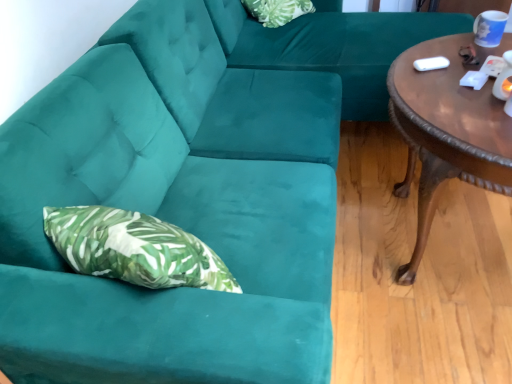
Question: From a real-world perspective, is velvet green couch at center on brown polished wood coffee table at right?

Choices:
 (A) no
 (B) yes

Answer: (B)

Question: Is velvet green couch at center turned away from brown polished wood coffee table at right?

Choices:
 (A) yes
 (B) no

Answer: (B)

Question: From the image's perspective, is velvet green couch at center above brown polished wood coffee table at right?

Choices:
 (A) no
 (B) yes

Answer: (B)

Question: Does velvet green couch at center come in front of brown polished wood coffee table at right?

Choices:
 (A) yes
 (B) no

Answer: (B)

Question: Is velvet green couch at center bigger than brown polished wood coffee table at right?

Choices:
 (A) no
 (B) yes

Answer: (B)

Question: Is point (414, 14) positioned closer to the camera than point (262, 11)?

Choices:
 (A) closer
 (B) farther

Answer: (A)

Question: Considering their positions, is velvet green couch at center located in front of or behind green leafy fabric pillow at upper center?

Choices:
 (A) behind
 (B) front

Answer: (B)

Question: Looking at their shapes, would you say velvet green couch at center is wider or thinner than green leafy fabric pillow at upper center?

Choices:
 (A) thin
 (B) wide

Answer: (B)

Question: Is velvet green couch at center taller or shorter than green leafy fabric pillow at upper center?

Choices:
 (A) short
 (B) tall

Answer: (B)

Question: Looking at their shapes, would you say brown polished wood coffee table at right is wider or thinner than green leafy fabric pillow at upper center?

Choices:
 (A) wide
 (B) thin

Answer: (A)

Question: Is point (477, 158) closer or farther from the camera than point (292, 13)?

Choices:
 (A) farther
 (B) closer

Answer: (B)

Question: Considering their positions, is brown polished wood coffee table at right located in front of or behind green leafy fabric pillow at upper center?

Choices:
 (A) behind
 (B) front

Answer: (B)

Question: In terms of height, does brown polished wood coffee table at right look taller or shorter compared to green leafy fabric pillow at upper center?

Choices:
 (A) short
 (B) tall

Answer: (B)

Question: From the image's perspective, is velvet green couch at center positioned above or below brown polished wood coffee table at right?

Choices:
 (A) above
 (B) below

Answer: (A)

Question: From a real-world perspective, is velvet green couch at center above or below brown polished wood coffee table at right?

Choices:
 (A) below
 (B) above

Answer: (B)